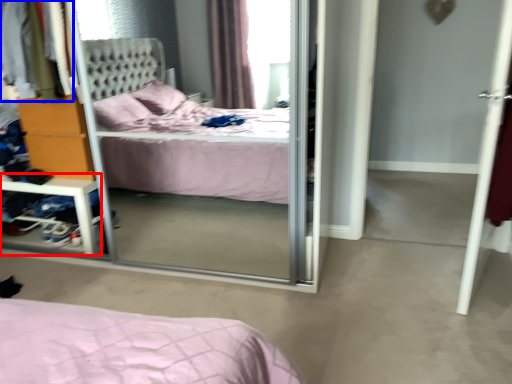
Question: Which point is closer to the camera, vanity (highlighted by a red box) or clothing (highlighted by a blue box)?

Choices:
 (A) vanity
 (B) clothing

Answer: (B)